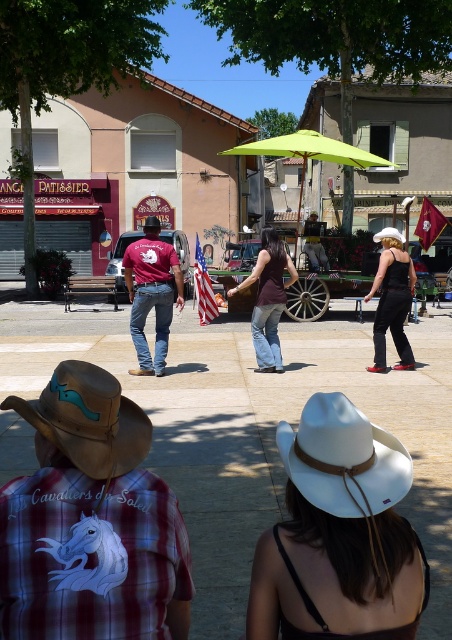
Is brown leather cowboy hat at lower left behind matte black jumpsuit at center?

No, it is in front of matte black jumpsuit at center.

Who is positioned more to the left, brown leather cowboy hat at lower left or matte black jumpsuit at center?

brown leather cowboy hat at lower left is more to the left.

Identify the location of brown leather cowboy hat at lower left. (88, 419).

Who is lower down, maroon fabric shirt at center or matte black jumpsuit at center?

maroon fabric shirt at center is lower down.

Is point (177, 285) closer to camera compared to point (401, 298)?

That is True.

Is point (164, 275) closer to viewer compared to point (385, 328)?

Yes.

You are a GUI agent. You are given a task and a screenshot of the screen. Output one action in this format:
    pyautogui.click(x=<x>, y=<y>)
    Task: Click on the maroon fabric shirt at center
    The image size is (452, 640).
    Given the screenshot: What is the action you would take?
    pyautogui.click(x=151, y=296)

Is point (133, 262) positioned behind point (213, 316)?

No, it is in front of (213, 316).

Can you confirm if maroon fabric shirt at center is positioned to the left of american flag at center?

Indeed, maroon fabric shirt at center is positioned on the left side of american flag at center.

Is point (144, 336) more distant than point (197, 240)?

No, (144, 336) is closer to viewer.

Identify the location of maroon fabric shirt at center. (151, 296).